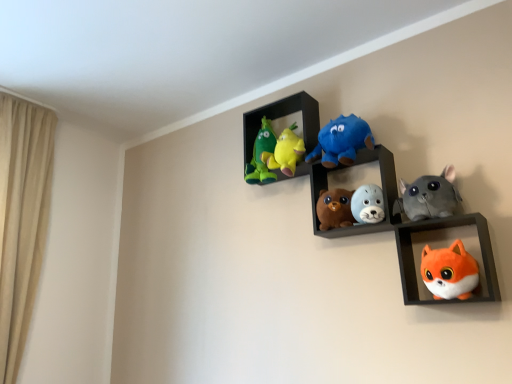
Question: Considering the positions of fluffy gray seal at center, placed as the fourth toy when sorted from left to right, and brown plush bear at center, which appears as the 2th toy when viewed from the left, in the image, is fluffy gray seal at center, placed as the fourth toy when sorted from left to right, wider or thinner than brown plush bear at center, which appears as the 2th toy when viewed from the left,?

Choices:
 (A) wide
 (B) thin

Answer: (B)

Question: Relative to brown plush bear at center, which appears as the 2th toy when viewed from the left, is fluffy gray seal at center, placed as the fourth toy when sorted from left to right, in front or behind?

Choices:
 (A) front
 (B) behind

Answer: (A)

Question: Considering the real-world distances, which object is closest to the brown plush bear at center, which appears as the 2th toy when viewed from the left?

Choices:
 (A) soft plush toys at center, arranged as the second shelf when viewed from the front
 (B) gray plush cat at upper right, which is the second toy from right to left
 (C) green plush toy at upper left, acting as the sixth toy starting from the right
 (D) velvet plush toys at upper center
 (E) orange plush fox at lower right, which is the 1th shelf from front to back

Answer: (A)

Question: Based on their relative distances, which object is nearer to the blue plush toy at center, the 3th toy when ordered from left to right?

Choices:
 (A) soft plush toys at center, which appears as the 1th shelf when viewed from the back
 (B) fluffy gray seal at center, placed as the fourth toy when sorted from left to right
 (C) orange plush toy at lower right, the first toy in the right-to-left sequence
 (D) orange plush fox at lower right, which is the 1th shelf from front to back
 (E) velvet plush toys at upper center

Answer: (A)